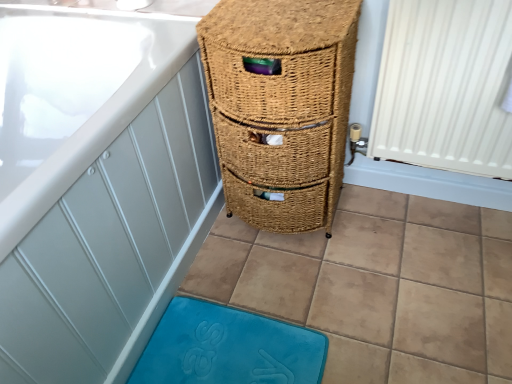
Describe the element at coordinates (281, 106) in the screenshot. The width and height of the screenshot is (512, 384). I see `woven brown drawer at center` at that location.

You are a GUI agent. You are given a task and a screenshot of the screen. Output one action in this format:
    pyautogui.click(x=<x>, y=<y>)
    Task: Click on the blue plush bath mat at lower center
    The width and height of the screenshot is (512, 384).
    Given the screenshot: What is the action you would take?
    pyautogui.click(x=228, y=348)

You are a GUI agent. You are given a task and a screenshot of the screen. Output one action in this format:
    pyautogui.click(x=<x>, y=<y>)
    Task: Click on the white ribbed radiator at right
    
    Given the screenshot: What is the action you would take?
    pyautogui.click(x=445, y=87)

Does white ribbed radiator at right turn towards woven brown drawer at center?

No, white ribbed radiator at right is not aimed at woven brown drawer at center.

What are the coordinates of `furniture below the white ribbed radiator at right (from a real-world perspective)` in the screenshot? It's located at (281, 106).

From a real-world perspective, does white ribbed radiator at right sit lower than woven brown drawer at center?

No, from a real-world perspective, white ribbed radiator at right is not under woven brown drawer at center.

Choose the correct answer: Is white ribbed radiator at right inside woven brown drawer at center or outside it?

white ribbed radiator at right cannot be found inside woven brown drawer at center.

Image resolution: width=512 pixels, height=384 pixels. There is a blue plush bath mat at lower center. What are the coordinates of `furniture above it (from a real-world perspective)` in the screenshot? It's located at (281, 106).

Consider the image. Is blue plush bath mat at lower center positioned far away from woven brown drawer at center?

blue plush bath mat at lower center is actually quite close to woven brown drawer at center.

Is blue plush bath mat at lower center located outside woven brown drawer at center?

Yes, blue plush bath mat at lower center is not within woven brown drawer at center.

From a real-world perspective, does blue plush bath mat at lower center stand above woven brown drawer at center?

No.

How different are the orientations of blue plush bath mat at lower center and white ribbed radiator at right in degrees?

There is a 91.2-degree angle between the facing directions of blue plush bath mat at lower center and white ribbed radiator at right.

Is blue plush bath mat at lower center positioned behind white ribbed radiator at right?

Yes, blue plush bath mat at lower center is behind white ribbed radiator at right.

Is blue plush bath mat at lower center to the left of white ribbed radiator at right from the viewer's perspective?

Correct, you'll find blue plush bath mat at lower center to the left of white ribbed radiator at right.

From a real-world perspective, which is physically below, woven brown drawer at center or white ribbed radiator at right?

From a 3D spatial view, woven brown drawer at center is below.

Can you see woven brown drawer at center touching white ribbed radiator at right?

No, woven brown drawer at center is not beside white ribbed radiator at right.

In terms of size, does woven brown drawer at center appear bigger or smaller than white ribbed radiator at right?

Clearly, woven brown drawer at center is larger in size than white ribbed radiator at right.

Which of these two, woven brown drawer at center or blue plush bath mat at lower center, is wider?

Wider between the two is blue plush bath mat at lower center.

Consider the image. From the image's perspective, which object appears higher, woven brown drawer at center or blue plush bath mat at lower center?

woven brown drawer at center, from the image's perspective.

How many degrees apart are the facing directions of woven brown drawer at center and blue plush bath mat at lower center?

The angle between the facing direction of woven brown drawer at center and the facing direction of blue plush bath mat at lower center is 90 degrees.

Considering the relative positions of woven brown drawer at center and blue plush bath mat at lower center in the image provided, is woven brown drawer at center to the left of blue plush bath mat at lower center from the viewer's perspective?

No, woven brown drawer at center is not to the left of blue plush bath mat at lower center.

From a real-world perspective, is white ribbed radiator at right below blue plush bath mat at lower center?

No, from a real-world perspective, white ribbed radiator at right is not under blue plush bath mat at lower center.

Can you tell me how much white ribbed radiator at right and blue plush bath mat at lower center differ in facing direction?

91.2 degrees separate the facing orientations of white ribbed radiator at right and blue plush bath mat at lower center.

Is white ribbed radiator at right taller or shorter than blue plush bath mat at lower center?

white ribbed radiator at right is taller than blue plush bath mat at lower center.

There is a woven brown drawer at center. Identify the location of radiator above it (from a real-world perspective). Image resolution: width=512 pixels, height=384 pixels. (445, 87).

Where is `furniture on the right of the blue plush bath mat at lower center`? This screenshot has width=512, height=384. furniture on the right of the blue plush bath mat at lower center is located at coordinates (281, 106).

Looking at the image, which one is located closer to white ribbed radiator at right, blue plush bath mat at lower center or woven brown drawer at center?

The object closer to white ribbed radiator at right is woven brown drawer at center.

When comparing their distances from woven brown drawer at center, does blue plush bath mat at lower center or white ribbed radiator at right seem further?

blue plush bath mat at lower center.

Estimate the real-world distances between objects in this image. Which object is closer to white ribbed radiator at right, woven brown drawer at center or blue plush bath mat at lower center?

woven brown drawer at center lies closer to white ribbed radiator at right than the other object.

Which object lies nearer to the anchor point blue plush bath mat at lower center, woven brown drawer at center or white ribbed radiator at right?

woven brown drawer at center lies closer to blue plush bath mat at lower center than the other object.

Estimate the real-world distances between objects in this image. Which object is further from blue plush bath mat at lower center, white ribbed radiator at right or woven brown drawer at center?

white ribbed radiator at right lies further to blue plush bath mat at lower center than the other object.

Looking at this image, looking at the image, which one is located further to woven brown drawer at center, white ribbed radiator at right or blue plush bath mat at lower center?

Among the two, blue plush bath mat at lower center is located further to woven brown drawer at center.

The image size is (512, 384). I want to click on furniture between white ribbed radiator at right and blue plush bath mat at lower center vertically, so click(281, 106).